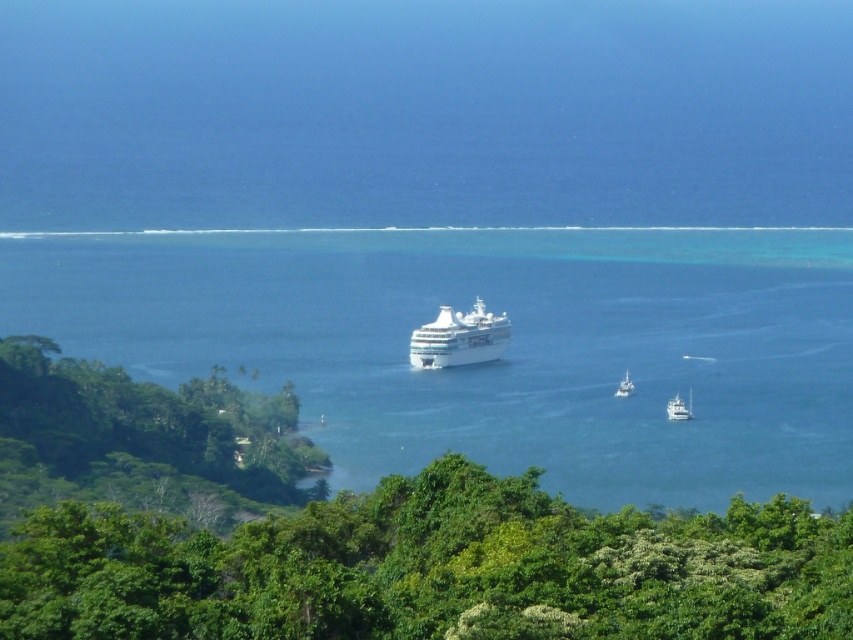
Does green leafy trees at center appear over white glossy boat at lower right?

No.

Who is lower down, green leafy trees at center or white glossy boat at lower right?

green leafy trees at center is below.

Who is more distant from viewer, (744,561) or (671,419)?

Point (671,419)

Identify the location of green leafy trees at center. (432, 568).

Does green leafy trees at center have a greater height compared to white glossy cruise ship at center?

Indeed, green leafy trees at center has a greater height compared to white glossy cruise ship at center.

What do you see at coordinates (432, 568) in the screenshot? I see `green leafy trees at center` at bounding box center [432, 568].

You are a GUI agent. You are given a task and a screenshot of the screen. Output one action in this format:
    pyautogui.click(x=<x>, y=<y>)
    Task: Click on the green leafy trees at center
    
    Given the screenshot: What is the action you would take?
    pyautogui.click(x=432, y=568)

Between point (480, 324) and point (622, 392), which one is positioned behind?

Point (622, 392)

Where is `white glossy cruise ship at center`? This screenshot has width=853, height=640. white glossy cruise ship at center is located at coordinates (459, 337).